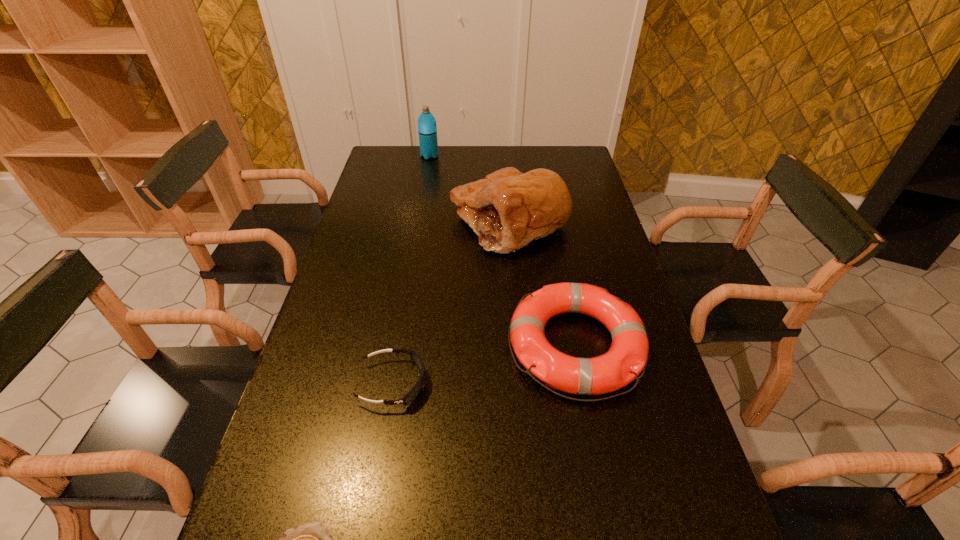
Identify which object is the fourth closest to the shortest object. Please provide its 2D coordinates. Your answer should be formatted as a tuple, i.e. [(x, y)], where the tuple contains the x and y coordinates of a point satisfying the conditions above.

[(427, 130)]

The height and width of the screenshot is (540, 960). Find the location of `object that is the second closest to the bread`. object that is the second closest to the bread is located at coordinates (427, 130).

I want to click on vacant space that satisfies the following two spatial constraints: 1. on the filling side of the life buoy; 2. on the left side of the bread, so click(x=519, y=345).

The height and width of the screenshot is (540, 960). What are the coordinates of `free region that satisfies the following two spatial constraints: 1. on the filling side of the life buoy; 2. on the right side of the bread` in the screenshot? It's located at (519, 345).